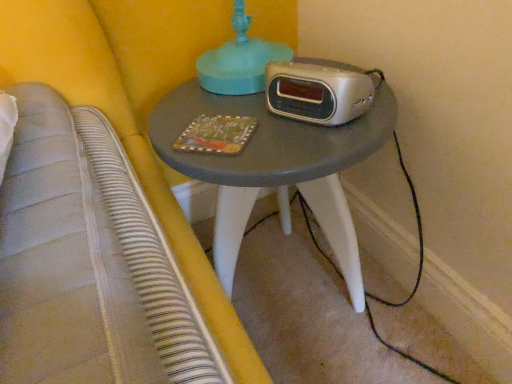
Question: Can you confirm if silver metallic alarm clock at center is taller than matte gray table at center?

Choices:
 (A) yes
 (B) no

Answer: (B)

Question: From a real-world perspective, is silver metallic alarm clock at center located beneath matte gray table at center?

Choices:
 (A) no
 (B) yes

Answer: (A)

Question: Does silver metallic alarm clock at center have a smaller size compared to matte gray table at center?

Choices:
 (A) no
 (B) yes

Answer: (B)

Question: From the image's perspective, is silver metallic alarm clock at center under matte gray table at center?

Choices:
 (A) yes
 (B) no

Answer: (B)

Question: From a real-world perspective, is silver metallic alarm clock at center over matte gray table at center?

Choices:
 (A) no
 (B) yes

Answer: (B)

Question: In terms of size, does wooden painted book at center appear bigger or smaller than silver metallic alarm clock at center?

Choices:
 (A) small
 (B) big

Answer: (A)

Question: Is wooden painted book at center in front of or behind silver metallic alarm clock at center in the image?

Choices:
 (A) behind
 (B) front

Answer: (A)

Question: Is wooden painted book at center inside the boundaries of silver metallic alarm clock at center, or outside?

Choices:
 (A) outside
 (B) inside

Answer: (A)

Question: From a real-world perspective, is wooden painted book at center above or below silver metallic alarm clock at center?

Choices:
 (A) below
 (B) above

Answer: (A)

Question: Is wooden painted book at center spatially inside matte gray table at center, or outside of it?

Choices:
 (A) inside
 (B) outside

Answer: (A)

Question: Relative to matte gray table at center, is wooden painted book at center in front or behind?

Choices:
 (A) front
 (B) behind

Answer: (B)

Question: Considering the positions of point (196, 132) and point (336, 206), is point (196, 132) closer or farther from the camera than point (336, 206)?

Choices:
 (A) closer
 (B) farther

Answer: (A)

Question: From the image's perspective, is wooden painted book at center above or below matte gray table at center?

Choices:
 (A) above
 (B) below

Answer: (A)

Question: From the image's perspective, is silver metallic alarm clock at center located above or below wooden painted book at center?

Choices:
 (A) above
 (B) below

Answer: (A)

Question: Is point (364, 89) positioned closer to the camera than point (228, 134)?

Choices:
 (A) closer
 (B) farther

Answer: (A)